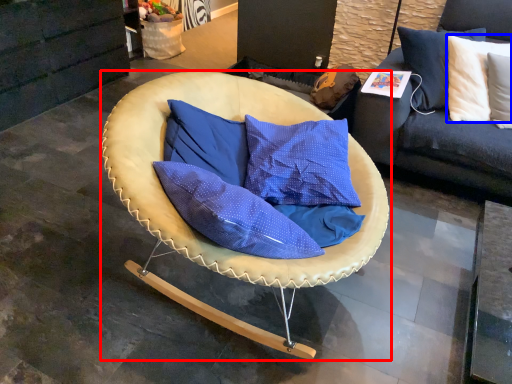
Question: Which object appears farthest to the camera in this image, chair (highlighted by a red box) or pillow (highlighted by a blue box)?

Choices:
 (A) chair
 (B) pillow

Answer: (B)